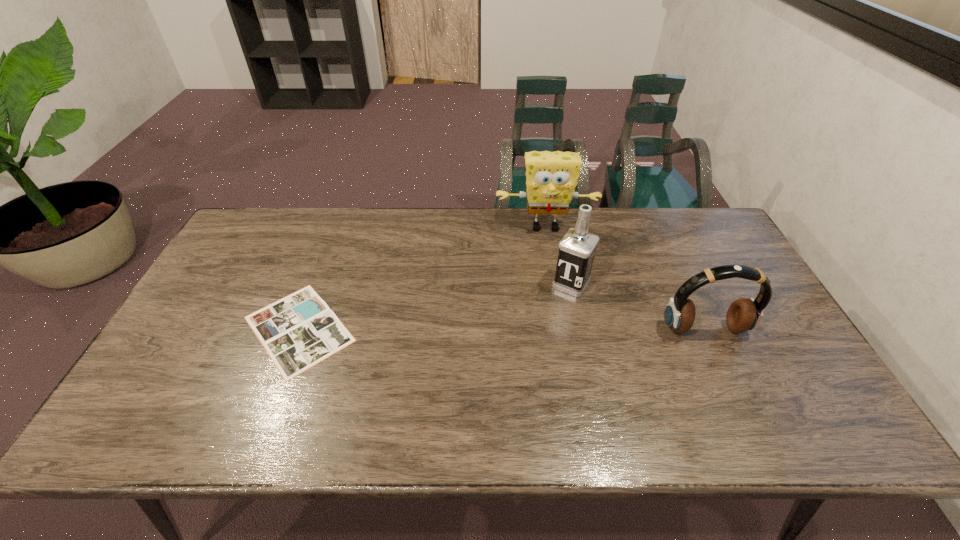
Where is `book`? book is located at coordinates (298, 331).

This screenshot has width=960, height=540. Find the location of `the shortest object`. the shortest object is located at coordinates (298, 331).

Locate an element on the screen. headset is located at coordinates (744, 314).

This screenshot has width=960, height=540. What are the coordinates of `the third tallest object` in the screenshot? It's located at (x=744, y=314).

Where is `the farthest object`? The image size is (960, 540). the farthest object is located at coordinates (551, 177).

This screenshot has height=540, width=960. In order to click on vodka in this screenshot , I will do `click(577, 248)`.

Where is `free space located 0.150m on the right of the leftmost object`? This screenshot has height=540, width=960. free space located 0.150m on the right of the leftmost object is located at coordinates coord(415,329).

Locate an element on the screen. The height and width of the screenshot is (540, 960). vacant region located 0.070m on the ear cup of the headset is located at coordinates (720, 363).

The height and width of the screenshot is (540, 960). Find the location of `vacant space located 0.260m on the face of the farthest object`. vacant space located 0.260m on the face of the farthest object is located at coordinates (553, 295).

Identify the location of vacant region located 0.090m on the face of the farthest object. This screenshot has width=960, height=540. (548, 256).